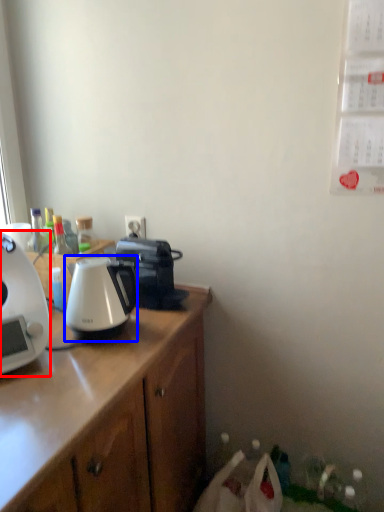
Question: Which object is closer to the camera taking this photo, coffee maker (highlighted by a red box) or kettle (highlighted by a blue box)?

Choices:
 (A) coffee maker
 (B) kettle

Answer: (A)